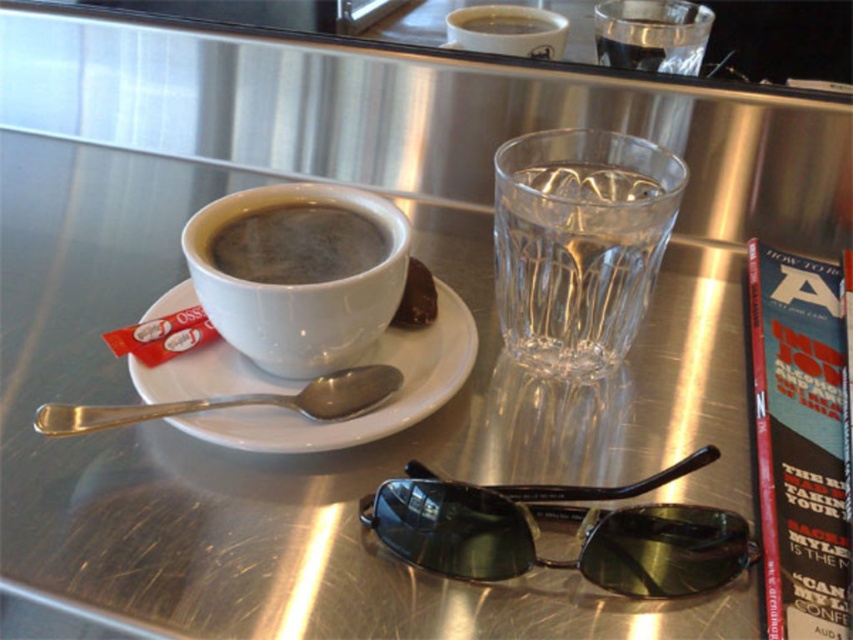
Between matte white cup at upper center and silver metallic spoon at upper center, which one appears on the left side from the viewer's perspective?

silver metallic spoon at upper center is more to the left.

Is matte white cup at upper center to the right of silver metallic spoon at upper center from the viewer's perspective?

Correct, you'll find matte white cup at upper center to the right of silver metallic spoon at upper center.

Where is `matte white cup at upper center`? Image resolution: width=853 pixels, height=640 pixels. matte white cup at upper center is located at coordinates (299, 244).

Locate an element on the screen. matte white cup at upper center is located at coordinates (299, 244).

How far apart are matte white cup at upper center and black matte cup at upper center?

The distance of matte white cup at upper center from black matte cup at upper center is 28.08 centimeters.

Describe the element at coordinates (299, 244) in the screenshot. I see `matte white cup at upper center` at that location.

I want to click on matte white cup at upper center, so click(x=299, y=244).

Who is positioned more to the left, white ceramic saucer at center or silver metallic spoon at upper center?

silver metallic spoon at upper center

Between white ceramic saucer at center and silver metallic spoon at upper center, which one is positioned higher?

white ceramic saucer at center

The width and height of the screenshot is (853, 640). I want to click on white ceramic saucer at center, so click(x=373, y=410).